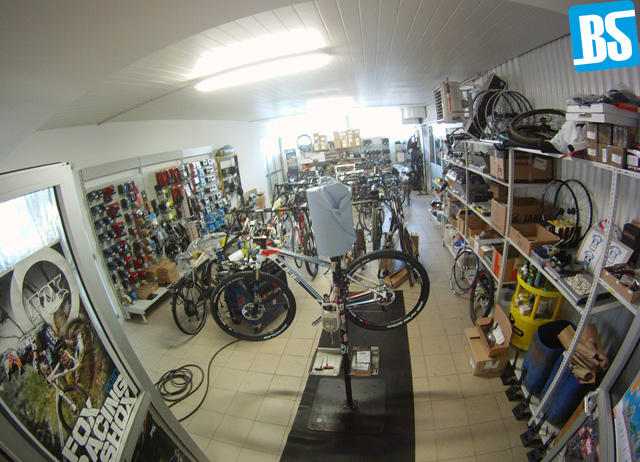
Identify the location of box. (483, 355).